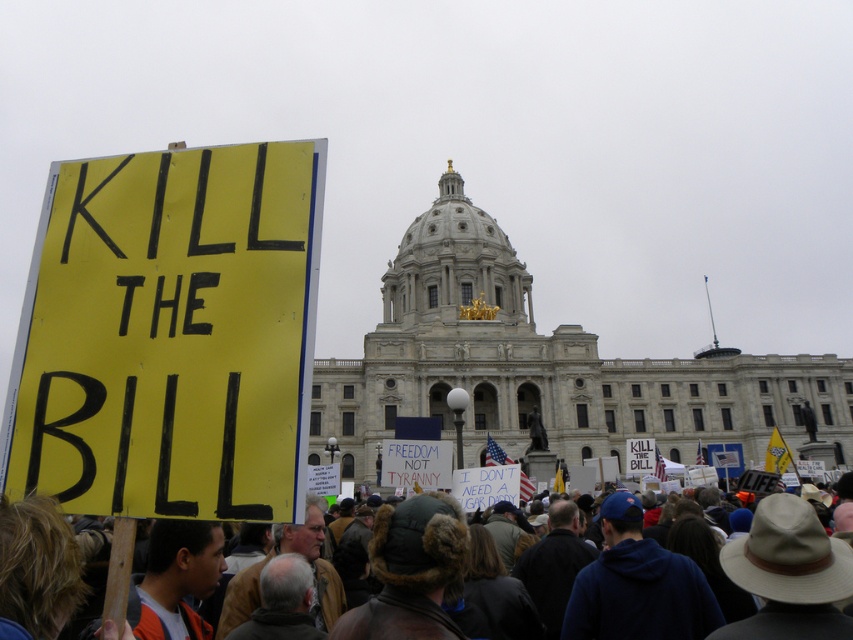
Question: Is the position of yellow paper sign at left more distant than that of brown leather jacket at lower center?

Choices:
 (A) yes
 (B) no

Answer: (B)

Question: Which point is closer to the camera taking this photo?

Choices:
 (A) (805, 538)
 (B) (225, 468)

Answer: (B)

Question: Which point is closer to the camera?

Choices:
 (A) (447, 516)
 (B) (194, 364)

Answer: (B)

Question: Does yellow paper sign at left have a larger size compared to brown leather jacket at lower center?

Choices:
 (A) yes
 (B) no

Answer: (B)

Question: Is yellow paper sign at left further to the viewer compared to brown leather jacket at lower center?

Choices:
 (A) no
 (B) yes

Answer: (A)